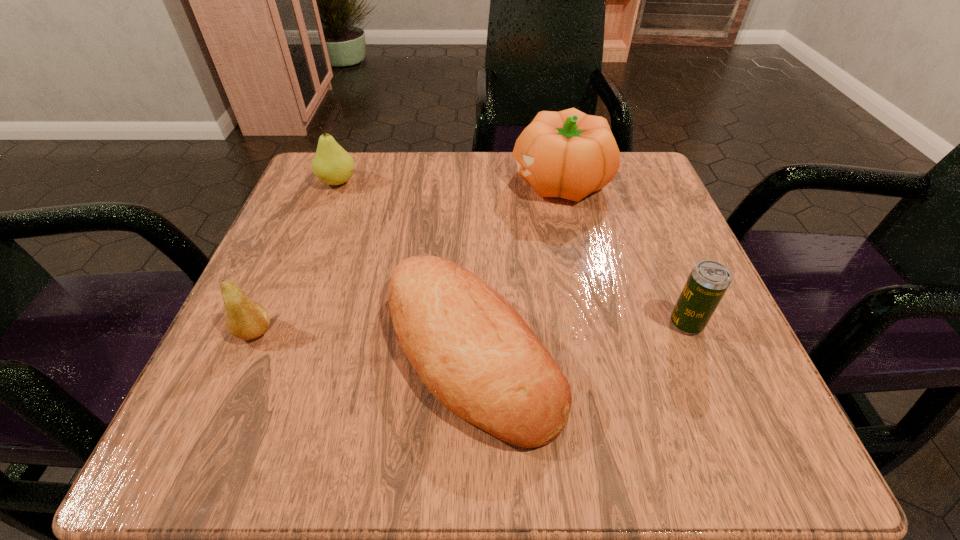
This screenshot has height=540, width=960. I want to click on vacant space that's between the bread and the tallest object, so click(516, 266).

Locate an element on the screen. free space between the beer can and the pumpkin is located at coordinates (623, 252).

Identify the location of vacant space that is in between the nearer pear and the pumpkin. (407, 256).

I want to click on vacant space that is in between the taller pear and the tallest object, so click(448, 181).

Where is `free point between the farther pear and the shorter pear`? free point between the farther pear and the shorter pear is located at coordinates (297, 257).

Select which object appears as the third closest to the rightmost object. Please provide its 2D coordinates. Your answer should be formatted as a tuple, i.e. [(x, y)], where the tuple contains the x and y coordinates of a point satisfying the conditions above.

[(245, 319)]

Select which object is the fourth closest to the pumpkin. Please provide its 2D coordinates. Your answer should be formatted as a tuple, i.e. [(x, y)], where the tuple contains the x and y coordinates of a point satisfying the conditions above.

[(245, 319)]

Locate an element on the screen. The image size is (960, 540). vacant region that satisfies the following two spatial constraints: 1. on the front side of the beer can; 2. on the right side of the taller pear is located at coordinates (282, 323).

Find the location of `vacant space that satisfies the following two spatial constraints: 1. on the carved face of the pumpkin; 2. on the left side of the beer can`. vacant space that satisfies the following two spatial constraints: 1. on the carved face of the pumpkin; 2. on the left side of the beer can is located at coordinates (591, 323).

Identify the location of vacant position in the image that satisfies the following two spatial constraints: 1. on the carved face of the beer can; 2. on the right side of the pumpkin. (591, 323).